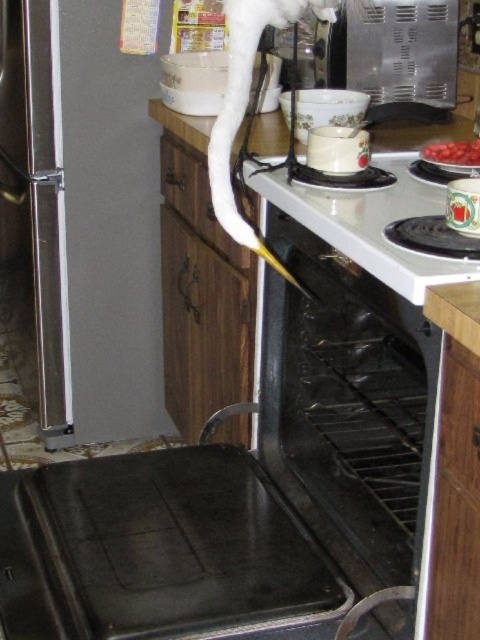
Question: Is white glossy stove at center positioned before smooth red tomatoes at upper right?

Choices:
 (A) no
 (B) yes

Answer: (B)

Question: Among these objects, which one is farthest from the camera?

Choices:
 (A) white glossy stove at center
 (B) smooth red tomatoes at upper right

Answer: (B)

Question: Is white glossy stove at center below smooth red tomatoes at upper right?

Choices:
 (A) no
 (B) yes

Answer: (B)

Question: Which point is farther to the camera?

Choices:
 (A) white glossy stove at center
 (B) smooth red tomatoes at upper right

Answer: (B)

Question: Is white glossy stove at center below smooth red tomatoes at upper right?

Choices:
 (A) yes
 (B) no

Answer: (A)